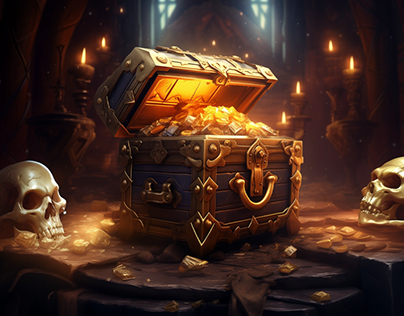
This screenshot has width=404, height=316. What are the coordinates of `wood sides` in the screenshot? It's located at (281, 175), (184, 177), (117, 92), (242, 64).